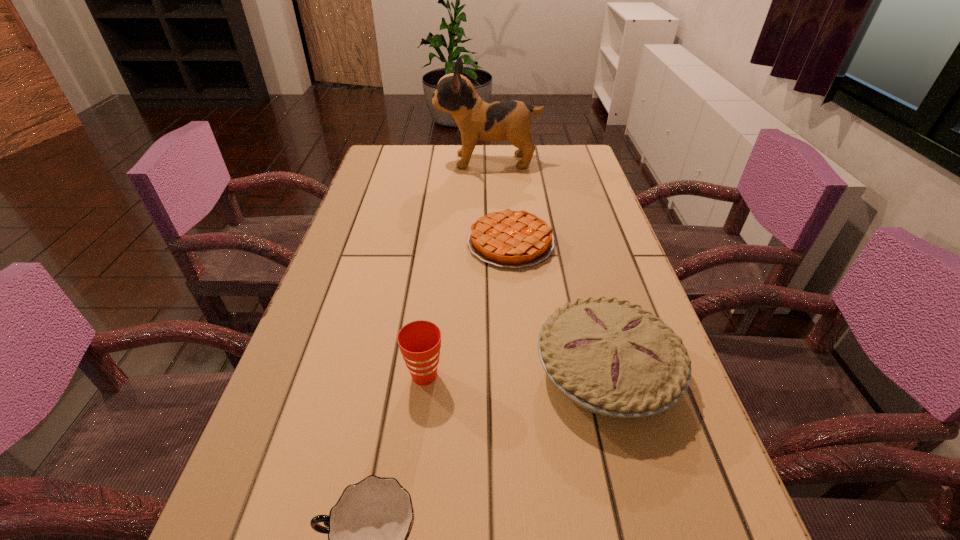
At what (x,y) coordinates should I click in order to perform the action: click on puppy. Please return your answer as a coordinate pair (x, y). Looking at the image, I should click on (477, 119).

Locate an element on the screen. The image size is (960, 540). the tallest object is located at coordinates (477, 119).

Find the location of a particular element. the taller cup is located at coordinates (419, 341).

Image resolution: width=960 pixels, height=540 pixels. Identify the location of the nearer pie. (611, 357).

Identify the location of the farther pie. (515, 239).

I want to click on the fourth nearest object, so click(x=515, y=239).

I want to click on vacant space located 0.220m at the face of the tallest object, so click(371, 161).

What are the coordinates of `free space located 0.210m at the face of the tallest object` in the screenshot? It's located at (373, 161).

Where is `vacant position located at the face of the tallest object`? The image size is (960, 540). vacant position located at the face of the tallest object is located at coordinates (395, 161).

Find the location of `vacant region located 0.220m on the right of the farther cup`. vacant region located 0.220m on the right of the farther cup is located at coordinates (562, 375).